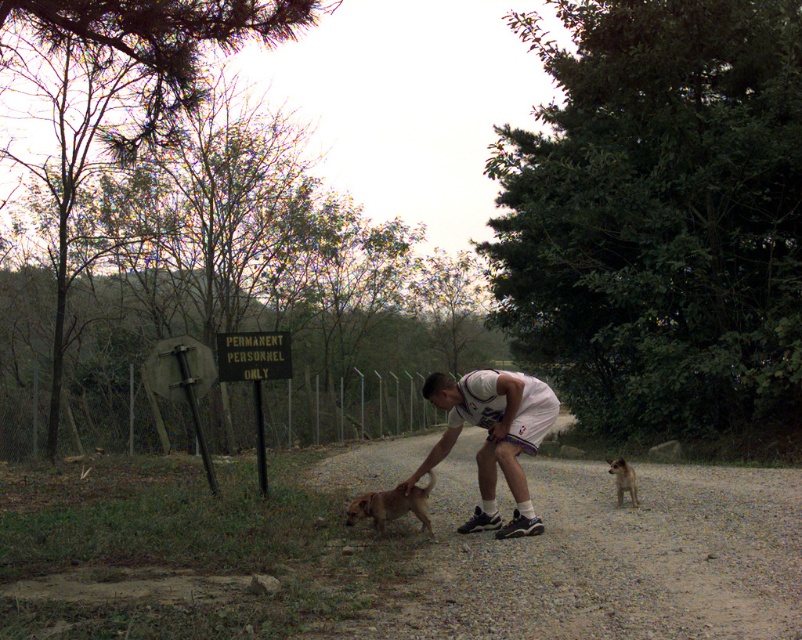
Who is lower down, green plastic sign at center or fuzzy brown dog at lower right?

Positioned lower is fuzzy brown dog at lower right.

Can you confirm if green plastic sign at center is wider than fuzzy brown dog at lower right?

Indeed, green plastic sign at center has a greater width compared to fuzzy brown dog at lower right.

This screenshot has width=802, height=640. In order to click on green plastic sign at center in this screenshot , I will do `click(253, 355)`.

Is green plastic sign at center taller than brown furry dog at center?

Indeed, green plastic sign at center has a greater height compared to brown furry dog at center.

What do you see at coordinates (253, 355) in the screenshot?
I see `green plastic sign at center` at bounding box center [253, 355].

Between point (221, 358) and point (363, 508), which one is positioned behind?

The point (221, 358) is more distant.

I want to click on green plastic sign at center, so click(253, 355).

Between brown furry dog at center and fuzzy brown dog at lower right, which one is positioned higher?

fuzzy brown dog at lower right

You are a GUI agent. You are given a task and a screenshot of the screen. Output one action in this format:
    pyautogui.click(x=<x>, y=<y>)
    Task: Click on the brown furry dog at center
    
    Given the screenshot: What is the action you would take?
    pyautogui.click(x=391, y=506)